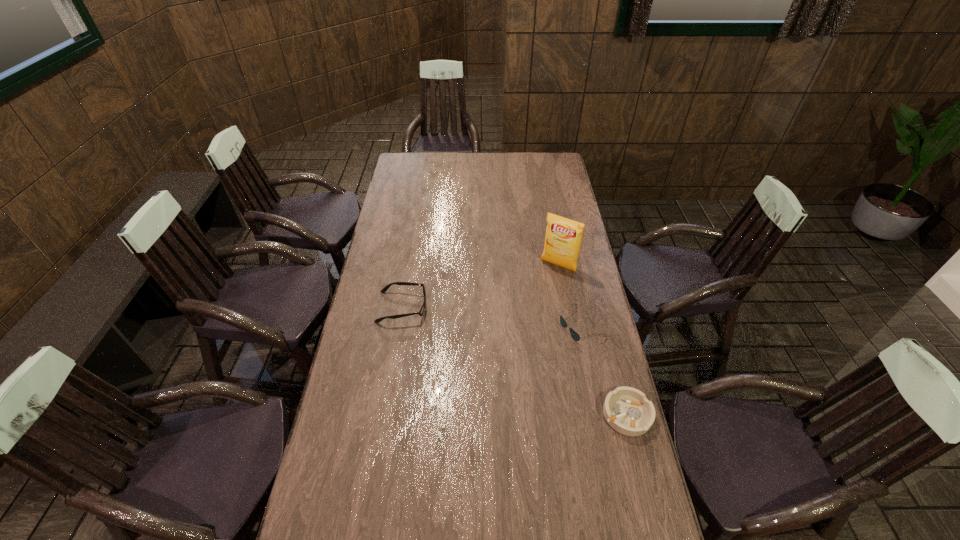
Find the location of `free spot located on the front of the farthest object with the logo`. free spot located on the front of the farthest object with the logo is located at coordinates (522, 319).

This screenshot has width=960, height=540. Find the location of `free space located on the front of the farthest object with the logo`. free space located on the front of the farthest object with the logo is located at coordinates (513, 334).

Locate an element on the screen. vacant region located on the front of the farthest object with the logo is located at coordinates (525, 314).

Identify the location of object that is at the left edge. Image resolution: width=960 pixels, height=540 pixels. (385, 288).

Identify the location of ashtray situated at the right edge. Image resolution: width=960 pixels, height=540 pixels. (627, 410).

At what (x,y) coordinates should I click in order to perform the action: click on sunglasses present at the right edge. Please return your answer as a coordinate pair (x, y). The width and height of the screenshot is (960, 540). Looking at the image, I should click on (575, 335).

Where is `crisp (potato chip) that is positioned at the right edge`? This screenshot has height=540, width=960. crisp (potato chip) that is positioned at the right edge is located at coordinates (563, 237).

Locate an element on the screen. This screenshot has height=540, width=960. vacant space at the left edge of the desktop is located at coordinates (340, 498).

I want to click on free space at the right edge of the desktop, so click(587, 275).

Where is `blank space at the far left corner of the desktop`? This screenshot has width=960, height=540. blank space at the far left corner of the desktop is located at coordinates (412, 161).